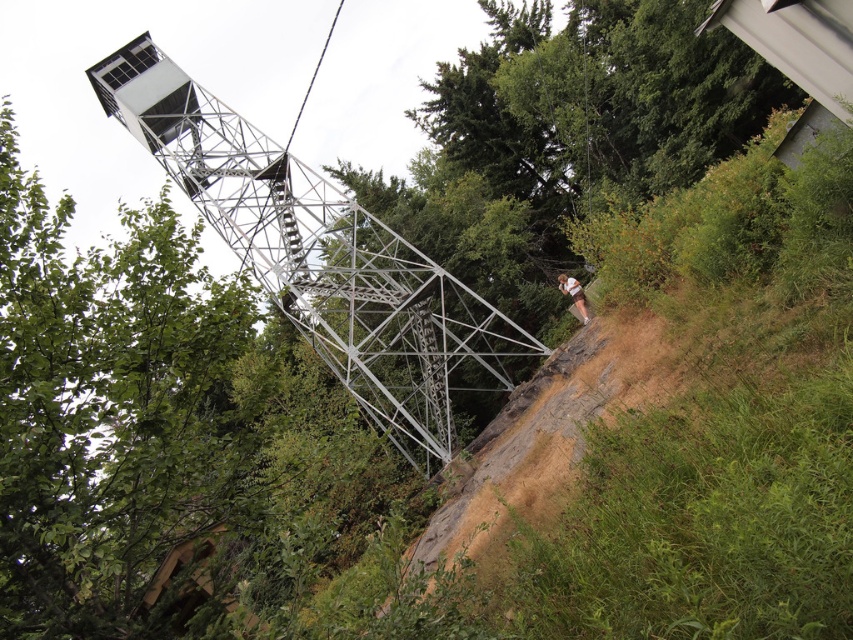
How much distance is there between metallic silver tower at upper left and brown dirt track at center-right?

metallic silver tower at upper left is 14.34 meters from brown dirt track at center-right.

This screenshot has width=853, height=640. I want to click on metallic silver tower at upper left, so click(x=321, y=257).

Between point (486, 376) and point (527, 497), which one is positioned behind?

Positioned behind is point (486, 376).

Locate an element on the screen. This screenshot has height=640, width=853. metallic silver tower at upper left is located at coordinates (321, 257).

Which is behind, point (148, 35) or point (589, 317)?

The point (148, 35) is behind.

Find the location of a particular element. This screenshot has height=640, width=853. metallic silver tower at upper left is located at coordinates (321, 257).

Is brown dirt track at center-right taller than brown leather pants at lower right?

Result: Yes, brown dirt track at center-right is taller than brown leather pants at lower right.

Who is positioned more to the left, brown dirt track at center-right or brown leather pants at lower right?

brown dirt track at center-right is more to the left.

Find the location of a particular element. brown dirt track at center-right is located at coordinates (543, 444).